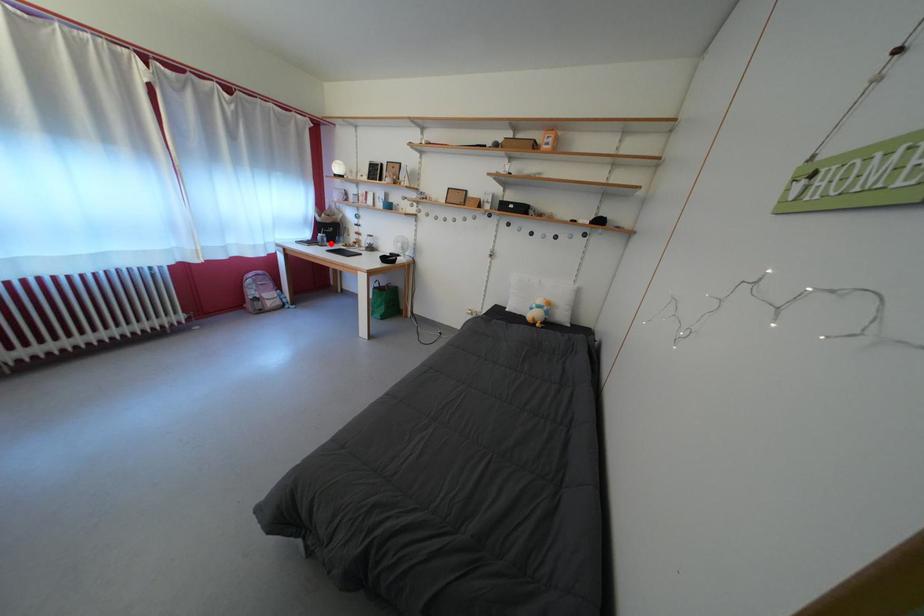
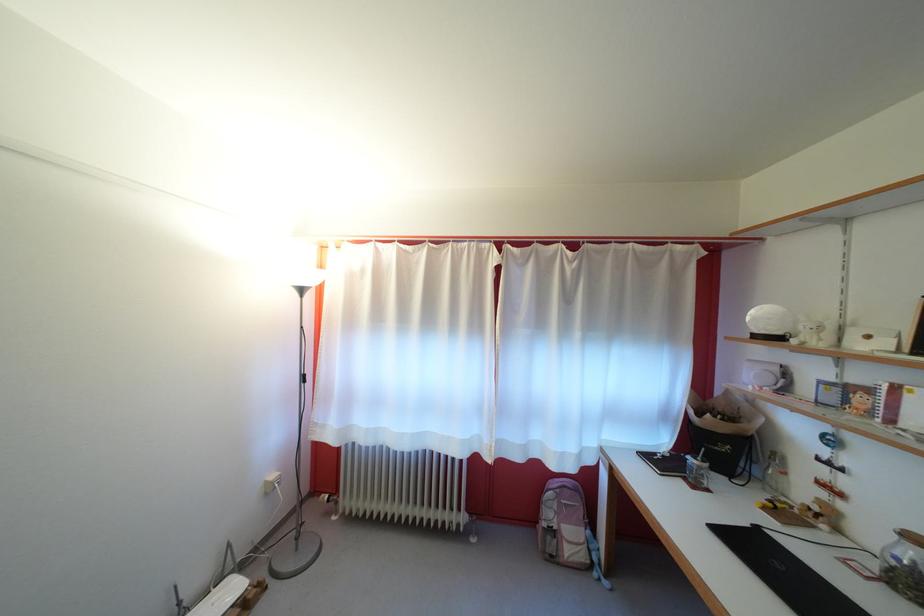
Find the pixel in the second image that matches the highlighted location in the first image.

(708, 474)